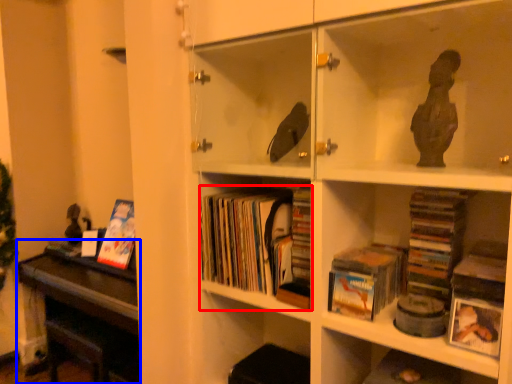
Question: Which point is closer to the camera, book (highlighted by a red box) or table (highlighted by a blue box)?

Choices:
 (A) book
 (B) table

Answer: (A)